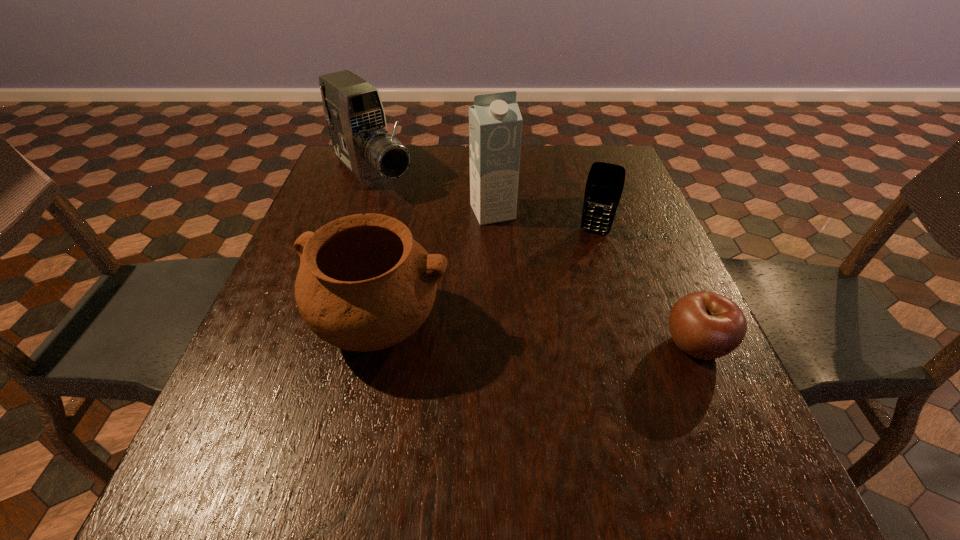
You are a GUI agent. You are given a task and a screenshot of the screen. Output one action in this format:
    pyautogui.click(x=<x>, y=<y>)
    Task: Click on the free space on the desktop that is between the pottery and the rightmost object and is positioned at the front of the camcorder, highlighting the lens
    This screenshot has height=540, width=960.
    Given the screenshot: What is the action you would take?
    pyautogui.click(x=536, y=335)

Where is `vacant space on the desktop that is between the pottery and the apple and is positioned on the screen of the cellular telephone`? vacant space on the desktop that is between the pottery and the apple and is positioned on the screen of the cellular telephone is located at coordinates (564, 336).

Where is `free spot on the desktop that is between the pottery and the apple and is positioned on the front label of the tallest object`? Image resolution: width=960 pixels, height=540 pixels. free spot on the desktop that is between the pottery and the apple and is positioned on the front label of the tallest object is located at coordinates (557, 336).